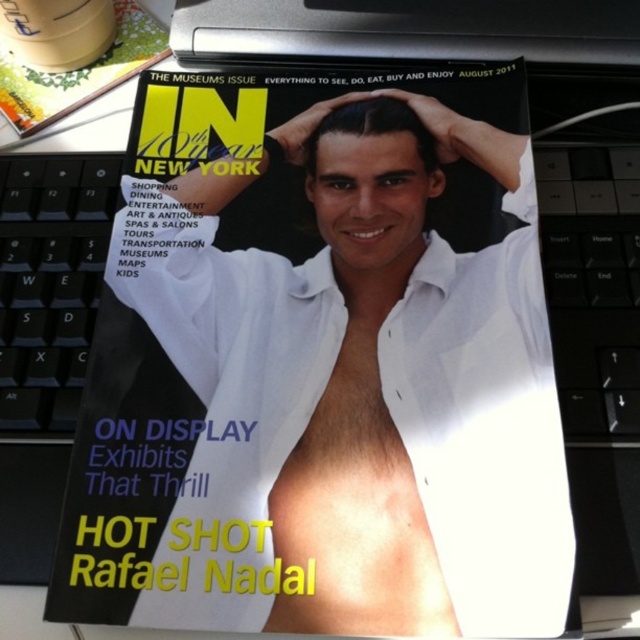
Does white matte shirt at center have a greater height compared to black plastic keyboard at left?

Correct, white matte shirt at center is much taller as black plastic keyboard at left.

What do you see at coordinates (356, 390) in the screenshot?
I see `white matte shirt at center` at bounding box center [356, 390].

The image size is (640, 640). I want to click on white matte shirt at center, so click(x=356, y=390).

Which is above, white matte shirt at center or matte yellow magazine at upper left?

matte yellow magazine at upper left

How much distance is there between white matte shirt at center and matte yellow magazine at upper left?

A distance of 12.68 inches exists between white matte shirt at center and matte yellow magazine at upper left.

Is point (326, 388) less distant than point (60, 90)?

Yes, it is in front of point (60, 90).

I want to click on white matte shirt at center, so click(x=356, y=390).

Is black plastic keyboard at left behind matte yellow magazine at upper left?

No, black plastic keyboard at left is closer to the viewer.

Image resolution: width=640 pixels, height=640 pixels. What do you see at coordinates (49, 282) in the screenshot? I see `black plastic keyboard at left` at bounding box center [49, 282].

Describe the element at coordinates (49, 282) in the screenshot. I see `black plastic keyboard at left` at that location.

This screenshot has height=640, width=640. I want to click on black plastic keyboard at left, so click(x=49, y=282).